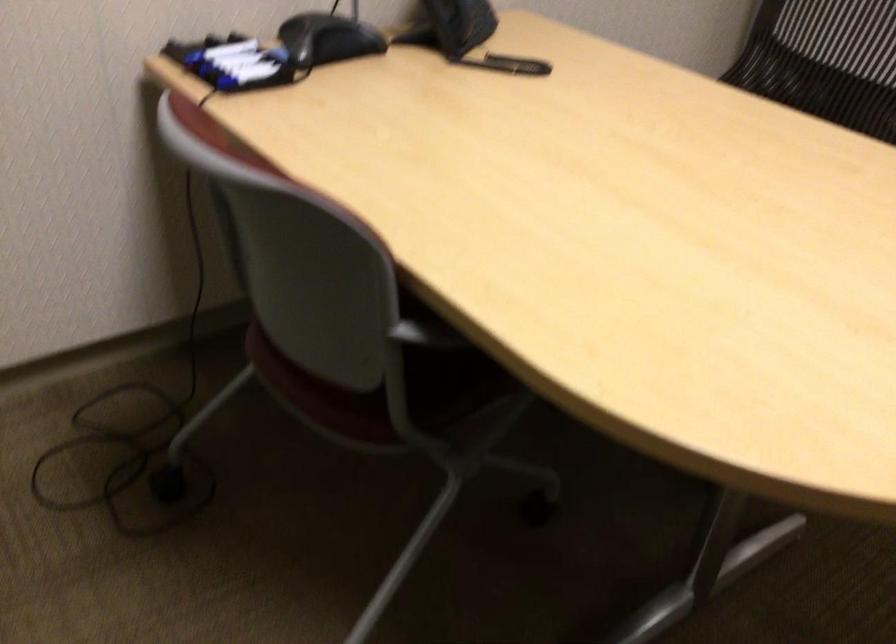
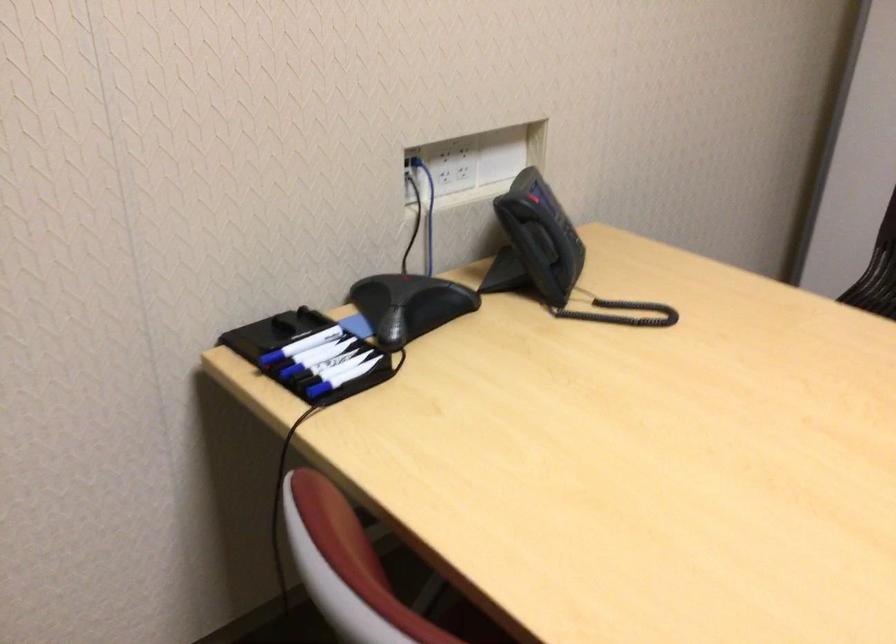
Question: The first image is from the beginning of the video and the second image is from the end. How did the camera likely rotate when shooting the video?

Choices:
 (A) Left
 (B) Right
 (C) Up
 (D) Down

Answer: (C)